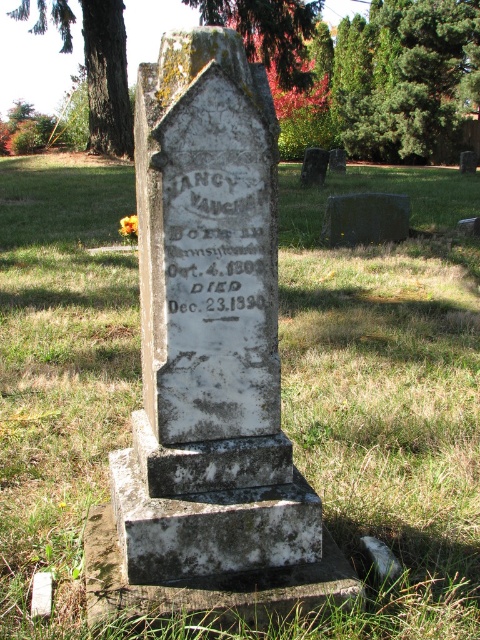
You are standing in front of the gravestone and see two points marked on it. Which point is closer to you, point (x=184, y=173) or point (x=340, y=164)?

Point (x=184, y=173) is in front of point (x=340, y=164), so it is closer to you.

What are the coordinates of the black stone inscription at center?

The black stone inscription at center is located at coordinates point (218,244).

You are a photographer planning to take a photo of the white marble gravestone at center. You want to ensure the green leafy tree at upper center does not block the gravestone in the shot. Based on their widths, can you determine if the tree will fit entirely to the side of the gravestone?

The green leafy tree at upper center has a lesser width compared to the white marble gravestone at center, so the tree will fit entirely to the side of the white marble gravestone at center without blocking it.